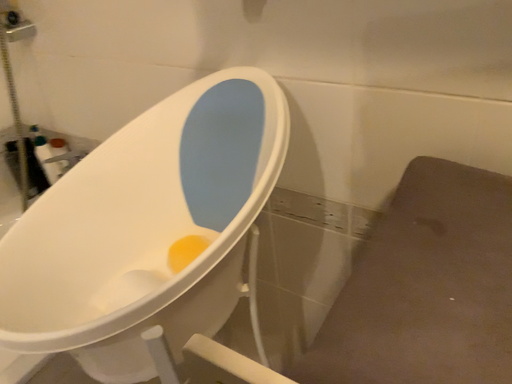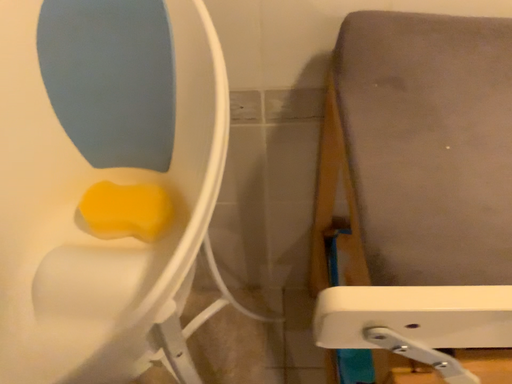
Question: How did the camera likely rotate when shooting the video?

Choices:
 (A) rotated left
 (B) rotated right

Answer: (B)